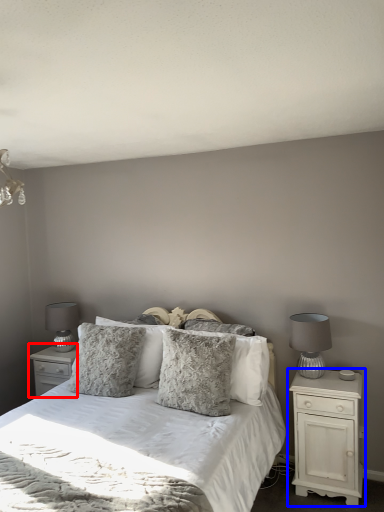
Question: Among these objects, which one is farthest to the camera, nightstand (highlighted by a red box) or nightstand (highlighted by a blue box)?

Choices:
 (A) nightstand
 (B) nightstand

Answer: (A)